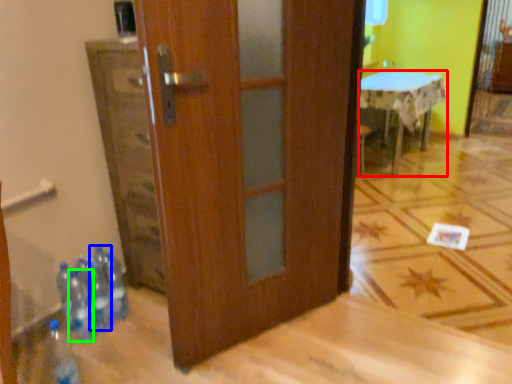
Question: Which object is positioned farthest from table (highlighted by a red box)? Select from bottle (highlighted by a blue box) and bottle (highlighted by a green box).

Choices:
 (A) bottle
 (B) bottle

Answer: (B)